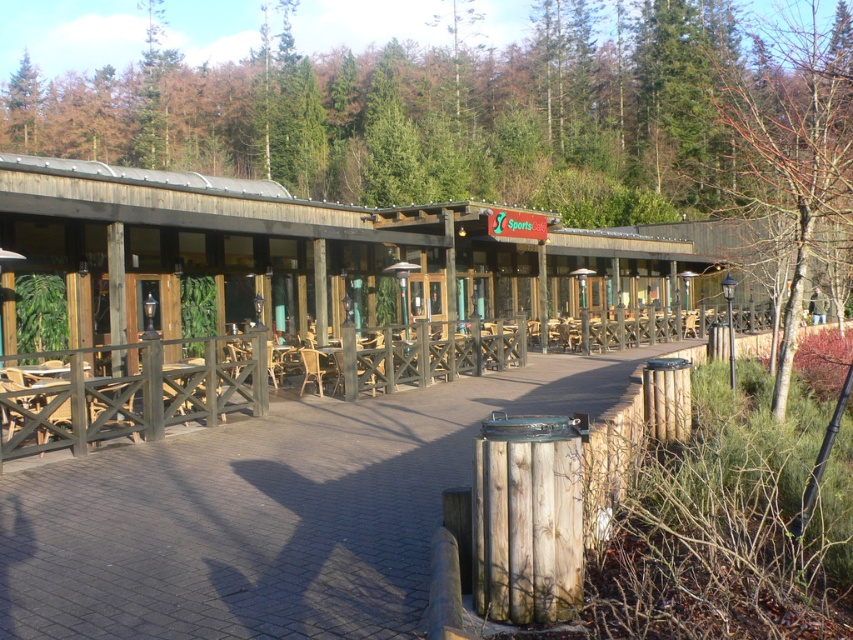
Is point (254, 481) less distant than point (769, 195)?

Yes, point (254, 481) is closer to viewer.

Find the location of a particular element. Image resolution: width=853 pixels, height=640 pixels. wooden walkway at center is located at coordinates (265, 513).